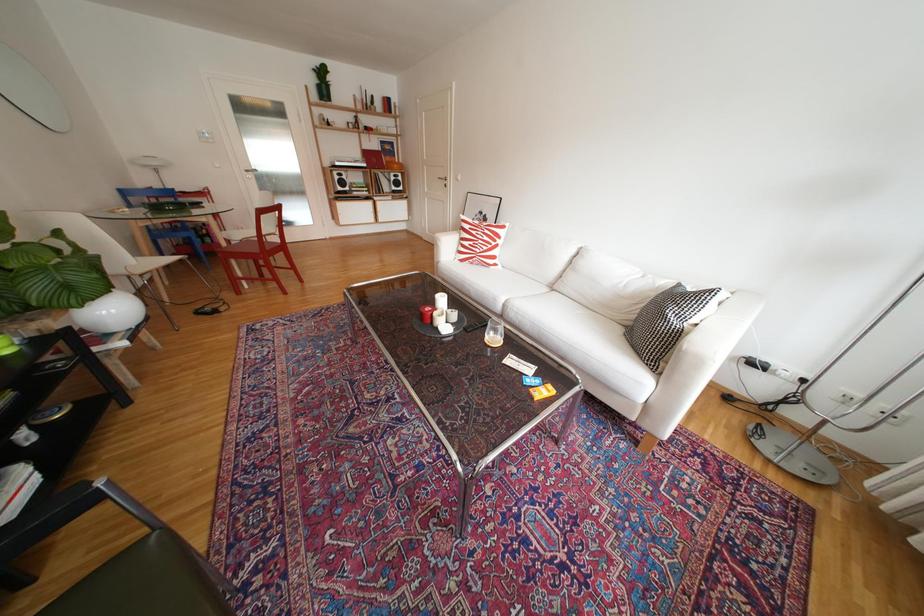
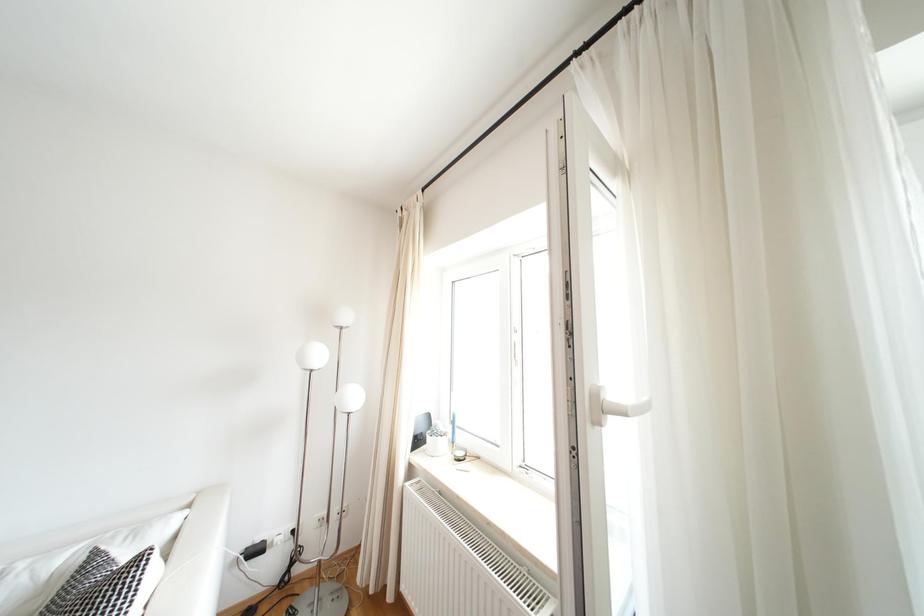
Question: The images are taken continuously from a first-person perspective. In which direction is your viewpoint rotating?

Choices:
 (A) Left
 (B) Right
 (C) Up
 (D) Down

Answer: (B)